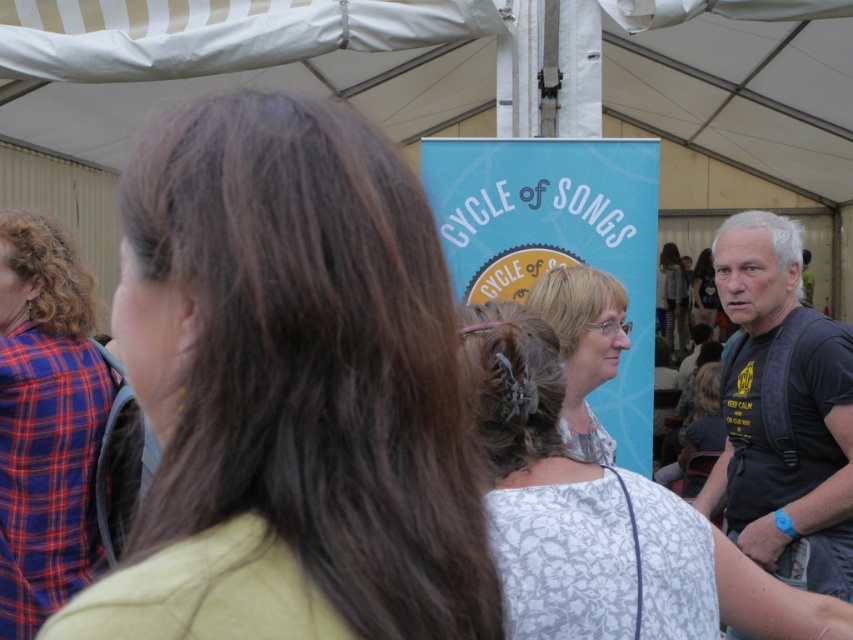
Can you confirm if white floral dress at center is positioned above white lace blouse at center?

Actually, white floral dress at center is below white lace blouse at center.

Which of these two, white floral dress at center or white lace blouse at center, stands shorter?

Standing shorter between the two is white lace blouse at center.

Find the location of a particular element. The width and height of the screenshot is (853, 640). white floral dress at center is located at coordinates (601, 518).

Can you confirm if plaid fabric shirt at left is thinner than white lace blouse at center?

No, plaid fabric shirt at left is not thinner than white lace blouse at center.

Between plaid fabric shirt at left and white lace blouse at center, which one appears on the left side from the viewer's perspective?

From the viewer's perspective, plaid fabric shirt at left appears more on the left side.

What do you see at coordinates (45, 420) in the screenshot? The image size is (853, 640). I see `plaid fabric shirt at left` at bounding box center [45, 420].

Image resolution: width=853 pixels, height=640 pixels. I want to click on plaid fabric shirt at left, so (45, 420).

Is point (792, 349) farther from camera compared to point (675, 268)?

That is False.

Does black t-shirt at right have a lesser width compared to white textured blouse at center?

Incorrect, black t-shirt at right's width is not less than white textured blouse at center's.

Between point (844, 566) and point (682, 316), which one is positioned in front?

Positioned in front is point (844, 566).

Identify the location of black t-shirt at right. The width and height of the screenshot is (853, 640). (782, 408).